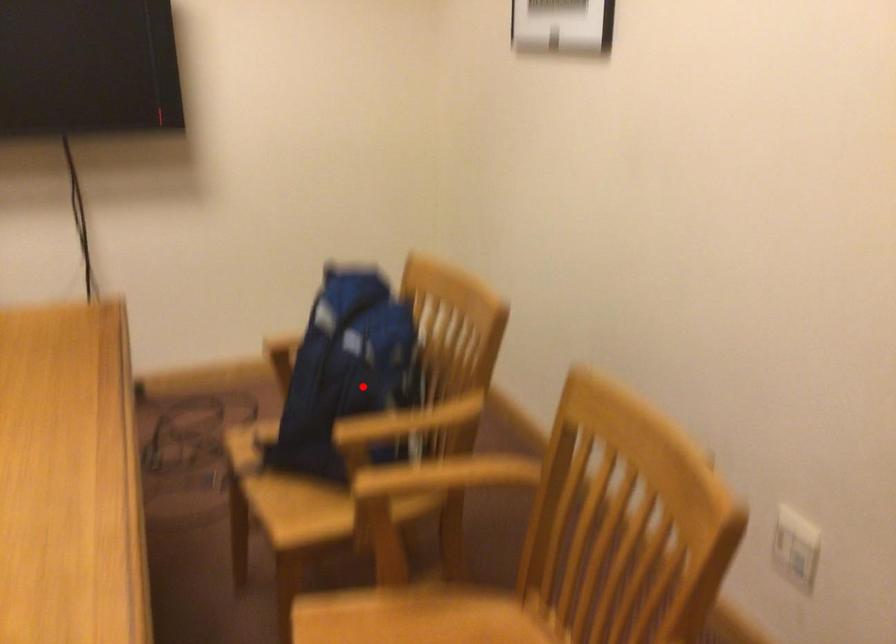
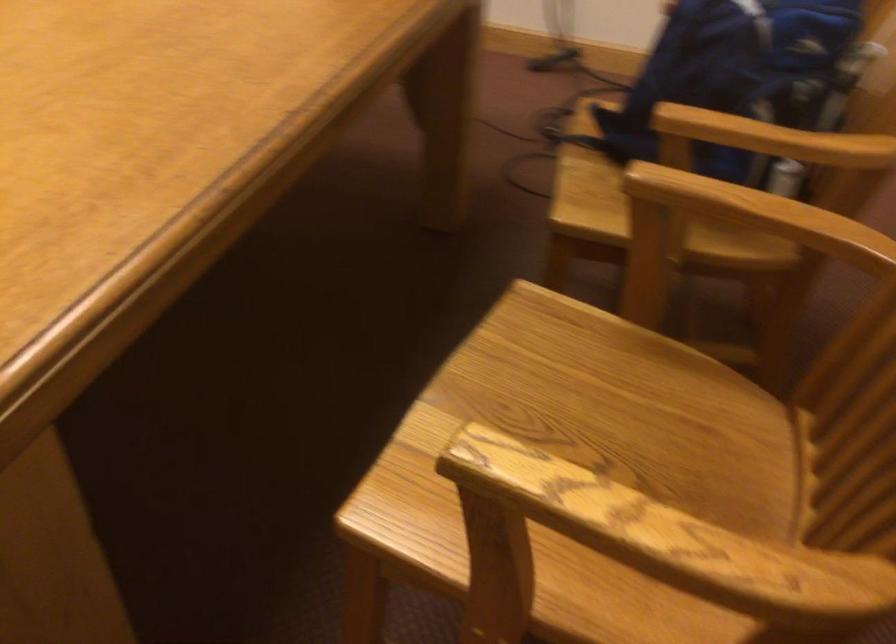
Question: I am providing you with two images of the same scene from different viewpoints. A red point is shown in image1. For the corresponding object point in image2, is it positioned nearer or farther from the camera?

Choices:
 (A) Nearer
 (B) Farther

Answer: (A)